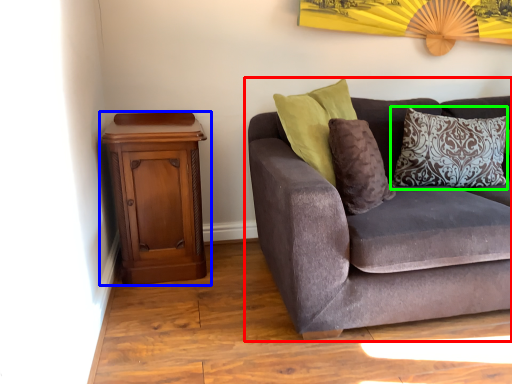
Question: Which object is positioned farthest from studio couch (highlighted by a red box)? Select from nightstand (highlighted by a blue box) and pillow (highlighted by a green box).

Choices:
 (A) nightstand
 (B) pillow

Answer: (A)